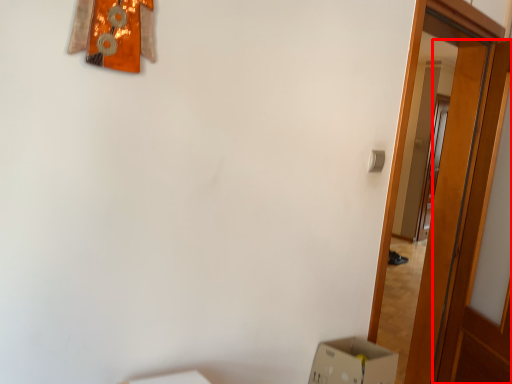
Question: Observing the image, what is the correct spatial positioning of door (annotated by the red box) in reference to door?

Choices:
 (A) right
 (B) left

Answer: (A)